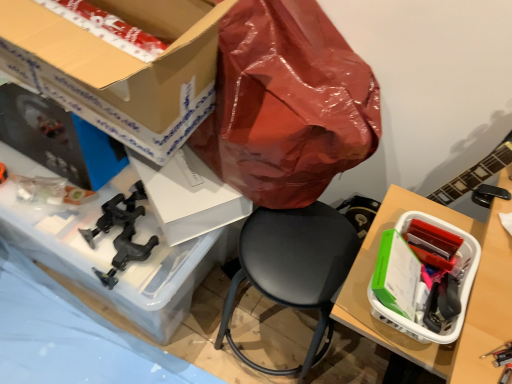
Question: Considering the relative sizes of cardboard box at upper left, the 1th box viewed from the left, and black leather chair at center in the image provided, is cardboard box at upper left, the 1th box viewed from the left, taller than black leather chair at center?

Choices:
 (A) yes
 (B) no

Answer: (B)

Question: Does cardboard box at upper left, which is counted as the 2th box, starting from the right, come in front of black leather chair at center?

Choices:
 (A) no
 (B) yes

Answer: (B)

Question: From the image's perspective, does cardboard box at upper left, which is the first box in top-to-bottom order, appear lower than black leather chair at center?

Choices:
 (A) yes
 (B) no

Answer: (B)

Question: Is cardboard box at upper left, the 1th box viewed from the left, aimed at black leather chair at center?

Choices:
 (A) no
 (B) yes

Answer: (A)

Question: Can you confirm if cardboard box at upper left, which is counted as the 2th box, starting from the right, is smaller than black leather chair at center?

Choices:
 (A) no
 (B) yes

Answer: (A)

Question: Is cardboard box at upper left, which is counted as the 2th box, starting from the right, bigger than black leather chair at center?

Choices:
 (A) yes
 (B) no

Answer: (A)

Question: Would you say black leather chair at center is part of white plastic basket at right, the 1th box positioned from the bottom,'s contents?

Choices:
 (A) yes
 (B) no

Answer: (B)

Question: Can you confirm if white plastic basket at right, the 1th box positioned from the bottom, is taller than black leather chair at center?

Choices:
 (A) no
 (B) yes

Answer: (A)

Question: From the image's perspective, is white plastic basket at right, the 1th box positioned from the bottom, below black leather chair at center?

Choices:
 (A) no
 (B) yes

Answer: (A)

Question: Is white plastic basket at right, the 1th box positioned from the bottom, looking in the opposite direction of black leather chair at center?

Choices:
 (A) no
 (B) yes

Answer: (A)

Question: From the image's perspective, is white plastic basket at right, which is counted as the 2th box, starting from the left, on top of black leather chair at center?

Choices:
 (A) yes
 (B) no

Answer: (A)

Question: Considering the relative positions of white plastic basket at right, the 1th box positioned from the bottom, and black leather chair at center in the image provided, is white plastic basket at right, the 1th box positioned from the bottom, in front of black leather chair at center?

Choices:
 (A) no
 (B) yes

Answer: (B)

Question: Considering the relative sizes of white plastic basket at right, the 1th box positioned from the bottom, and cardboard box at upper left, arranged as the 2th box when ordered from the bottom, in the image provided, is white plastic basket at right, the 1th box positioned from the bottom, thinner than cardboard box at upper left, arranged as the 2th box when ordered from the bottom,?

Choices:
 (A) yes
 (B) no

Answer: (A)